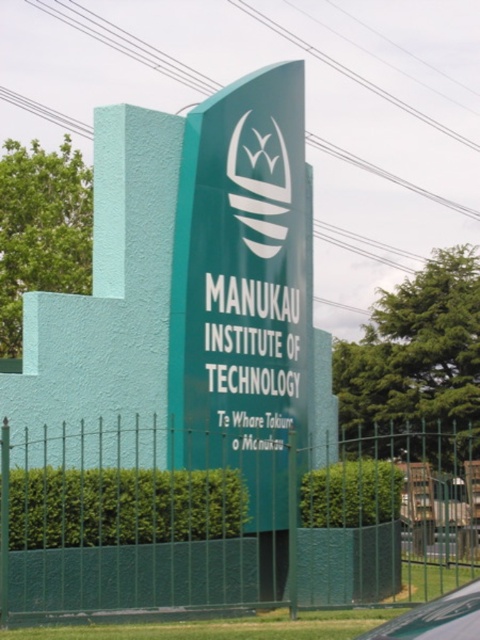
Question: Considering the relative positions of green metal fence at lower center and green leafy hedge at lower center in the image provided, where is green metal fence at lower center located with respect to green leafy hedge at lower center?

Choices:
 (A) right
 (B) left

Answer: (A)

Question: Which object is closer to the camera taking this photo?

Choices:
 (A) green leafy hedge at lower center
 (B) green metal fence at lower center

Answer: (B)

Question: Does green metal fence at lower center have a larger size compared to green leafy hedge at center?

Choices:
 (A) yes
 (B) no

Answer: (A)

Question: Which object is farther from the camera taking this photo?

Choices:
 (A) green metal fence at lower center
 (B) green leafy hedge at lower center

Answer: (B)

Question: Can you confirm if green leafy hedge at lower center is positioned to the left of green leafy hedge at center?

Choices:
 (A) no
 (B) yes

Answer: (B)

Question: Which point appears closest to the camera in this image?

Choices:
 (A) (376, 506)
 (B) (149, 532)
 (C) (132, 589)

Answer: (C)